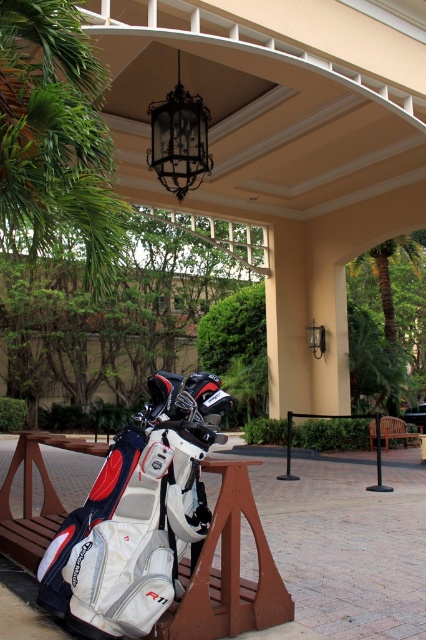
Can you confirm if green leafy palm tree at upper left is positioned below white fabric park bench at lower left?

No, green leafy palm tree at upper left is not below white fabric park bench at lower left.

Find the location of `green leafy palm tree at upper left`. green leafy palm tree at upper left is located at coordinates pos(55,136).

Where is `green leafy palm tree at upper left`? The width and height of the screenshot is (426, 640). green leafy palm tree at upper left is located at coordinates (55, 136).

In the scene shown: Can you confirm if green leafy palm tree at upper left is shorter than brown wooden park bench at lower right?

Correct, green leafy palm tree at upper left is not as tall as brown wooden park bench at lower right.

Between point (9, 8) and point (371, 426), which one is positioned behind?

Positioned behind is point (371, 426).

Find the location of a particular element. This screenshot has width=426, height=640. green leafy palm tree at upper left is located at coordinates (55, 136).

Is white fabric park bench at lower left to the right of brown wooden park bench at lower right from the viewer's perspective?

Incorrect, white fabric park bench at lower left is not on the right side of brown wooden park bench at lower right.

Does white fabric park bench at lower left come behind brown wooden park bench at lower right?

No.

Between point (247, 509) and point (368, 429), which one is positioned behind?

The point (368, 429) is behind.

At what (x,y) coordinates should I click in order to perform the action: click on white fabric park bench at lower left. Please return your answer as a coordinate pair (x, y). The image size is (426, 640). Looking at the image, I should click on (229, 570).